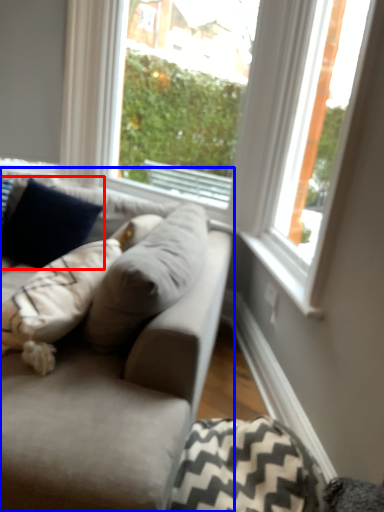
Question: Which of the following is the farthest to the observer, pillow (highlighted by a red box) or studio couch (highlighted by a blue box)?

Choices:
 (A) pillow
 (B) studio couch

Answer: (A)